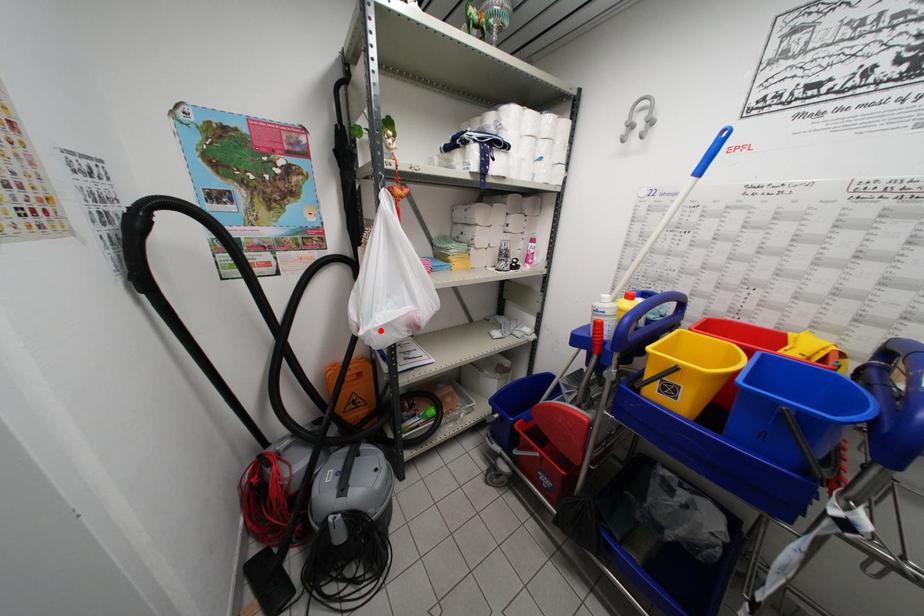
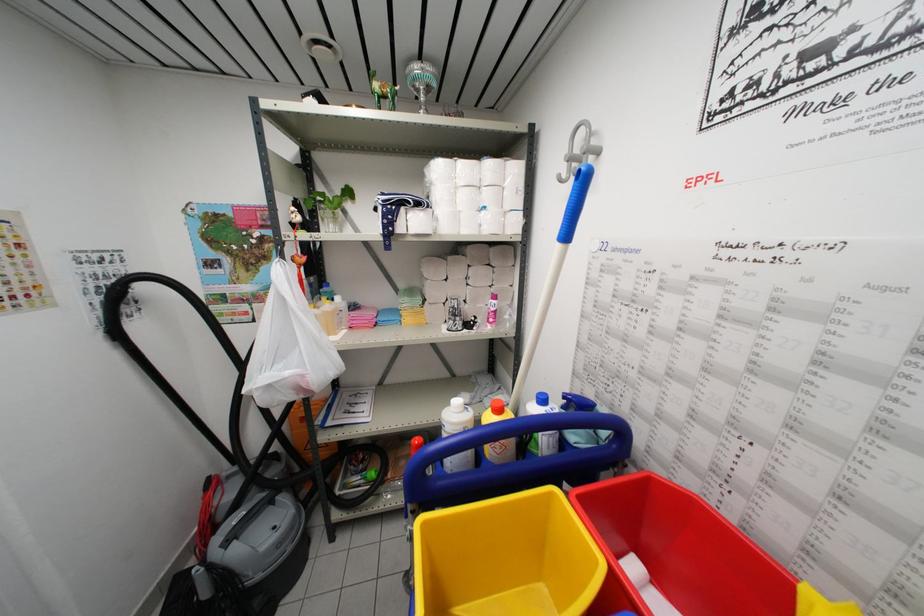
The point at the highlighted location is marked in the first image. Where is the corresponding point in the second image?

(258, 392)